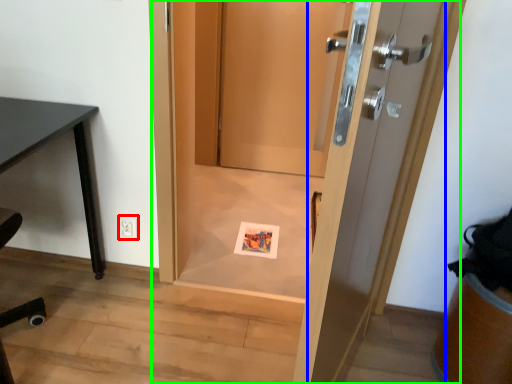
Question: Based on their relative distances, which object is nearer to electric outlet (highlighted by a red box)? Choose from door (highlighted by a blue box) and door (highlighted by a green box).

Choices:
 (A) door
 (B) door

Answer: (B)